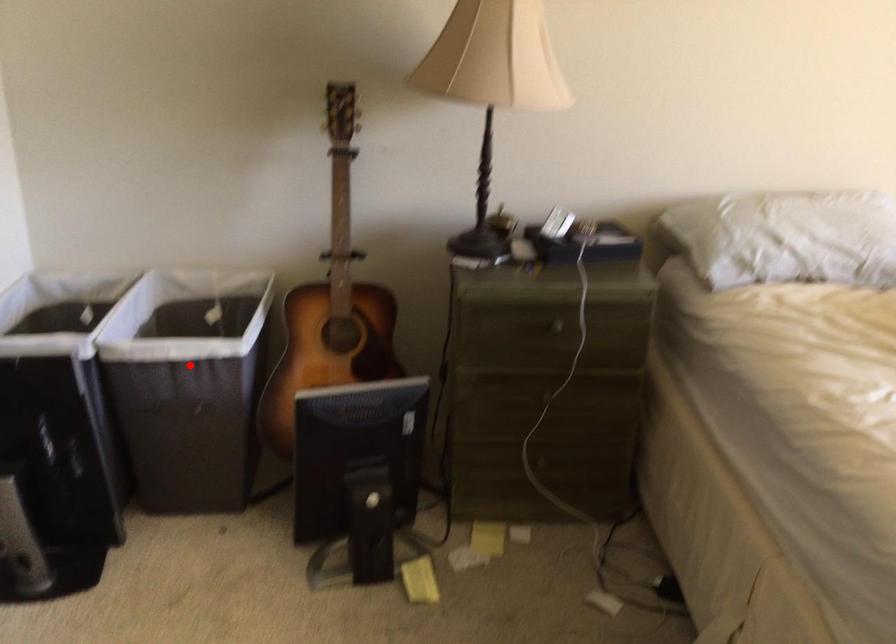
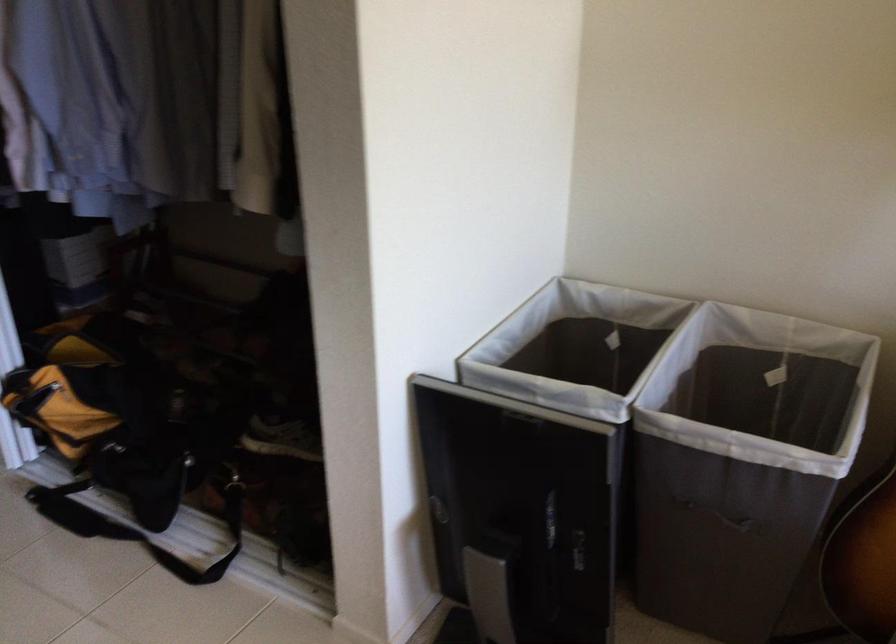
The point at the highlighted location is marked in the first image. Where is the corresponding point in the second image?

(742, 462)